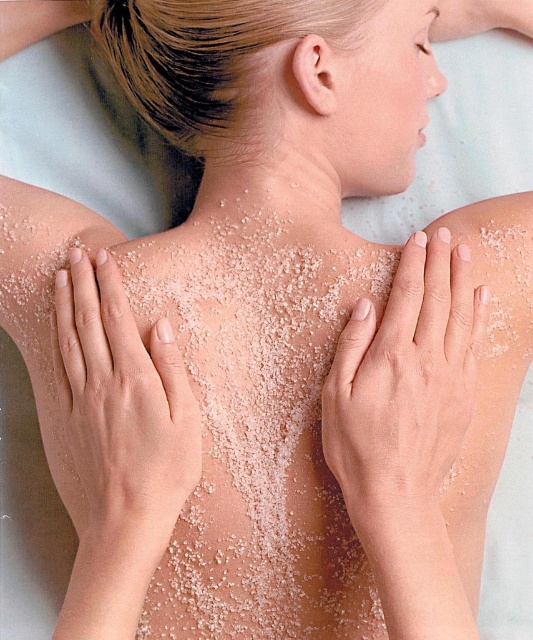
Is the position of smooth skin at upper center more distant than that of white granular skin at center?

No, it is not.

Is point (401, 442) farther from camera compared to point (192, 160)?

No, it is in front of (192, 160).

This screenshot has width=533, height=640. I want to click on smooth skin at upper center, so click(405, 387).

Does smooth skin at upper center appear over smooth skin at left?

Yes, smooth skin at upper center is above smooth skin at left.

Between point (367, 529) and point (116, 508), which one is positioned behind?

Point (367, 529)

Where is `smooth skin at upper center`? The image size is (533, 640). smooth skin at upper center is located at coordinates (405, 387).

Looking at this image, can you confirm if smooth skin at left is positioned above white granular skin at center?

No, smooth skin at left is not above white granular skin at center.

Does smooth skin at left appear under white granular skin at center?

Indeed, smooth skin at left is positioned under white granular skin at center.

Is point (99, 408) positioned after point (173, 180)?

No, it is not.

The width and height of the screenshot is (533, 640). Identify the location of smooth skin at left. (123, 410).